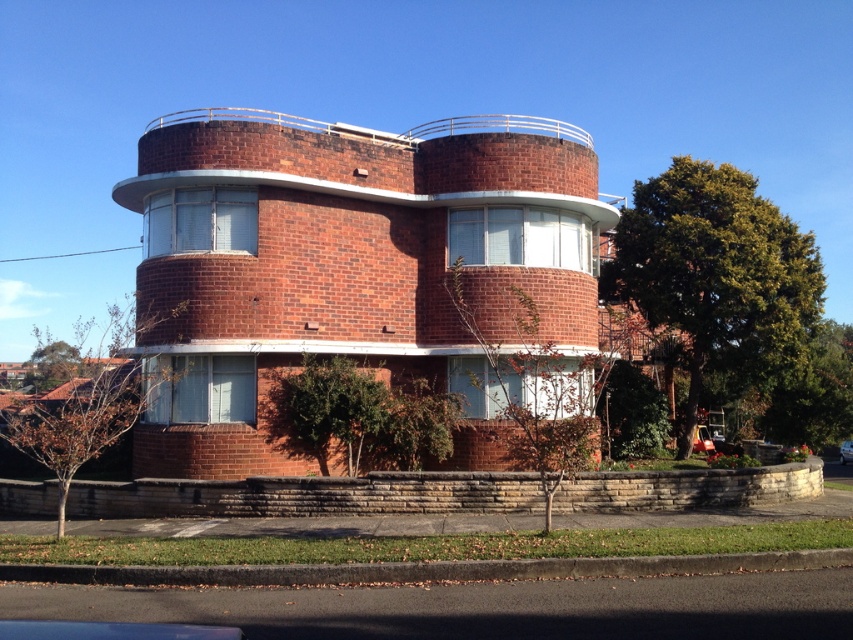
Can you confirm if metallic silver car at lower right is positioned to the left of silver metallic car at center?

Correct, you'll find metallic silver car at lower right to the left of silver metallic car at center.

Is metallic silver car at lower right shorter than silver metallic car at center?

Indeed, metallic silver car at lower right has a lesser height compared to silver metallic car at center.

Find the location of `metallic silver car at lower right`. metallic silver car at lower right is located at coordinates (701, 440).

At what (x,y) coordinates should I click in order to perform the action: click on metallic silver car at lower right. Please return your answer as a coordinate pair (x, y). The width and height of the screenshot is (853, 640). Looking at the image, I should click on (701, 440).